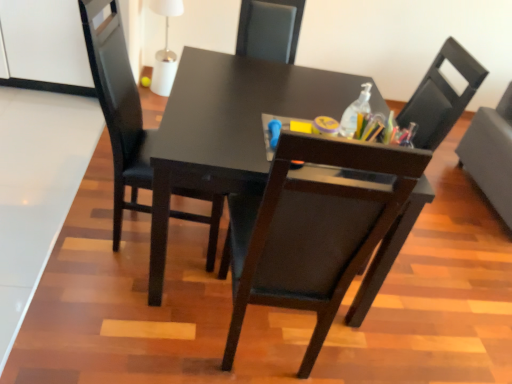
Question: Relative to black matte chair at right, acting as the 3th chair starting from the left, is matte black chair at center, marked as the 2th chair in a right-to-left arrangement, in front or behind?

Choices:
 (A) front
 (B) behind

Answer: (A)

Question: From a real-world perspective, is matte black chair at center, marked as the 2th chair in a right-to-left arrangement, physically located above or below black matte chair at right, acting as the 3th chair starting from the left?

Choices:
 (A) below
 (B) above

Answer: (B)

Question: Estimate the real-world distances between objects in this image. Which object is closer to the black matte chair at right, the 1th chair when ordered from right to left?

Choices:
 (A) matte black chair at center, which ranks as the third chair in right-to-left order
 (B) matte black chair at center, the second chair from the left
 (C) clear plastic bottle at upper right

Answer: (B)

Question: Which object is the closest to the matte black chair at center, marked as the 2th chair in a right-to-left arrangement?

Choices:
 (A) black matte chair at right, acting as the 3th chair starting from the left
 (B) clear plastic bottle at upper right
 (C) matte black chair at center, the first chair in the left-to-right sequence

Answer: (B)